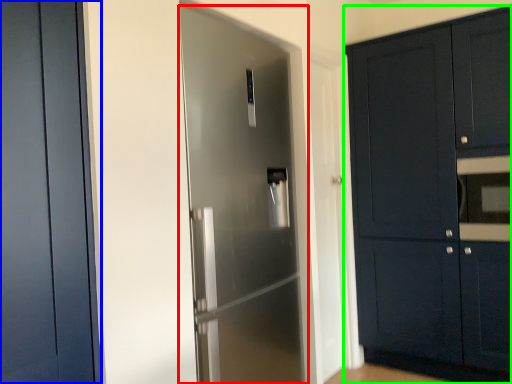
Question: Estimate the real-world distances between objects in this image. Which object is farther from door (highlighted by a red box), door (highlighted by a blue box) or cabinetry (highlighted by a green box)?

Choices:
 (A) door
 (B) cabinetry

Answer: (B)